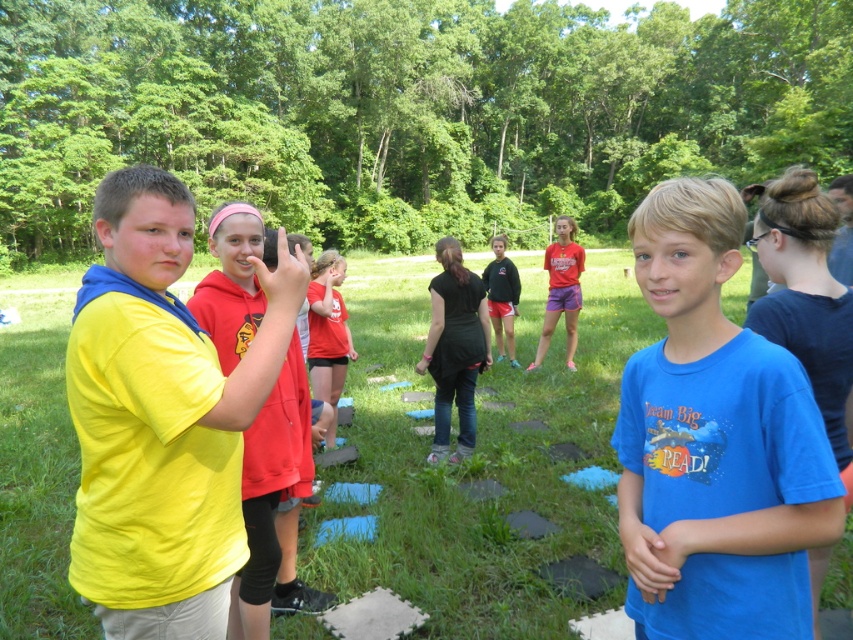
You are a photographer standing in the park and want to take a photo that includes both the green grass at center and the yellow matte shirt at left. Which object should you focus on first to ensure both are in clear view?

The green grass at center is further to the viewer than the yellow matte shirt at left, so you should focus on the green grass at center first to ensure both are in clear view.

You are a photographer trying to capture both the blue cotton shirt at center and the black matte shirt at center in a single shot. Which one should you focus on first to ensure both are in clear view?

You should focus on the blue cotton shirt at center first since it is closer to the viewer than the black matte shirt at center, ensuring both are in focus when using depth of field.

You are a photographer trying to capture a photo of both the blue cotton shirt at center and the black matte shirt at center. Since you want to ensure both are fully visible, which one should you focus on to avoid cropping the top of the taller one?

The black matte shirt at center is taller than the blue cotton shirt at center, so you should focus on the black matte shirt at center to avoid cropping the top of the taller one.